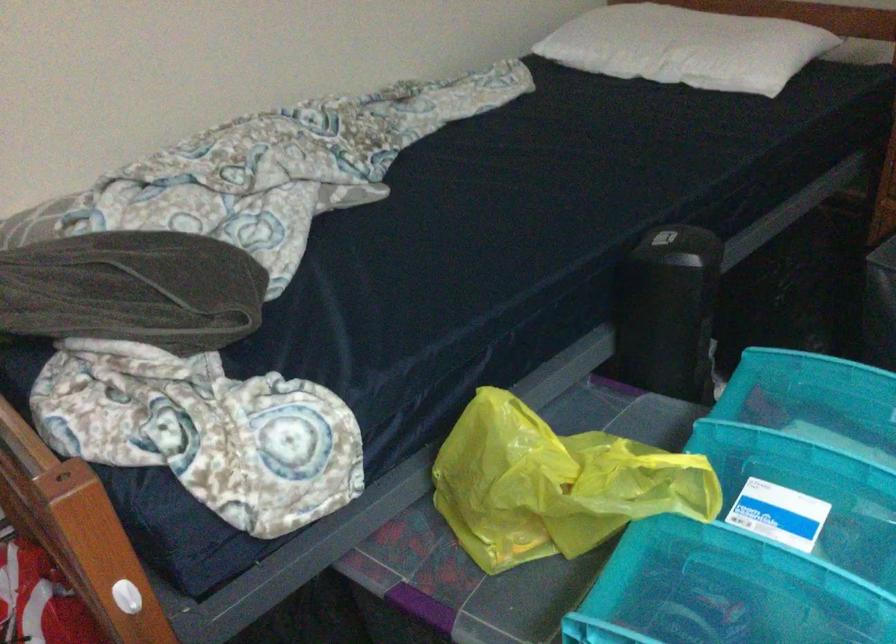
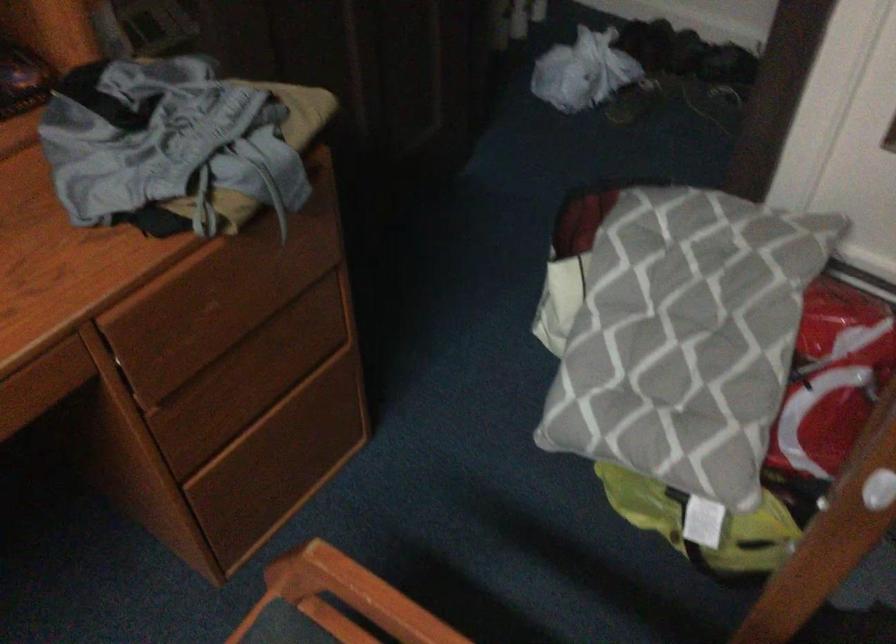
First-person continuous shooting, in which direction is the camera rotating?

The camera rotated toward left-down.